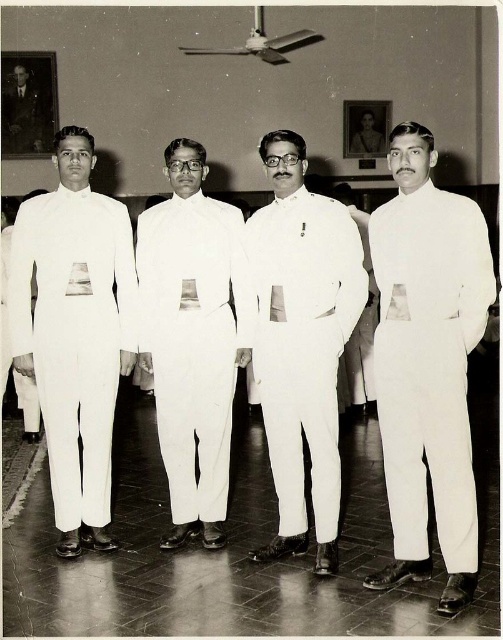
You are a photographer adjusting your camera to focus on two points in the image. The first point is point (154, 243) and the second is point (367, 328). Which point should you focus on first if you want to capture the closest object to the camera?

Point (154, 243) is closer to the viewer than point (367, 328), so you should focus on point (154, 243) first to capture the closest object.

You are standing in the room where the four men are posing. You want to place a small decorative pin exactly at the center of the white smooth suit at center. According to the coordinates provided, where should you place the pin?

The pin should be placed at the coordinates point [193,339], which is where the white smooth suit at center is located.

You are a photographer who needs to adjust the lighting for a group photo. The subjects are wearing the white smooth uniform at center and the smooth black suit at left. Which subject should you adjust the lighting for to ensure proper exposure, considering their height difference?

The white smooth uniform at center is much taller than the smooth black suit at left. To ensure proper exposure, adjust the lighting for the taller subject, the white smooth uniform at center, as they may cast shadows over the shorter one.